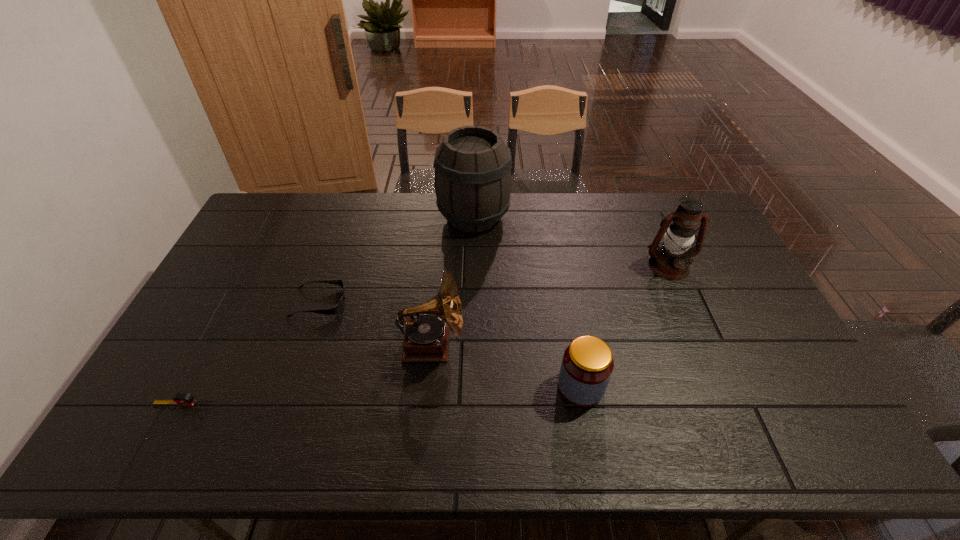
Where is `free space located on the side of the fifth nearest object, there is a wick adjustment knob`? The height and width of the screenshot is (540, 960). free space located on the side of the fifth nearest object, there is a wick adjustment knob is located at coordinates (714, 369).

The image size is (960, 540). I want to click on vacant area situated on the horn of the third tallest object, so 526,344.

The height and width of the screenshot is (540, 960). In order to click on vacant space situated on the back of the jar in this screenshot , I will do `click(571, 337)`.

You are a GUI agent. You are given a task and a screenshot of the screen. Output one action in this format:
    pyautogui.click(x=<x>, y=<y>)
    Task: Click on the blank space located on the right of the tape measure
    
    Given the screenshot: What is the action you would take?
    pyautogui.click(x=365, y=403)

Find the location of a particular element. The width and height of the screenshot is (960, 540). free space located 0.340m on the front-facing side of the second object from left to right is located at coordinates (458, 302).

Where is `object located in the far edge section of the desktop`? This screenshot has width=960, height=540. object located in the far edge section of the desktop is located at coordinates (472, 180).

Identify the location of object that is at the left edge. The image size is (960, 540). (181, 399).

Locate an element on the screen. object that is at the right edge is located at coordinates click(671, 261).

In the image, there is a desktop. Where is `vacant space at the far edge`? This screenshot has height=540, width=960. vacant space at the far edge is located at coordinates (435, 211).

The height and width of the screenshot is (540, 960). Find the location of `vacant region at the near edge`. vacant region at the near edge is located at coordinates (689, 433).